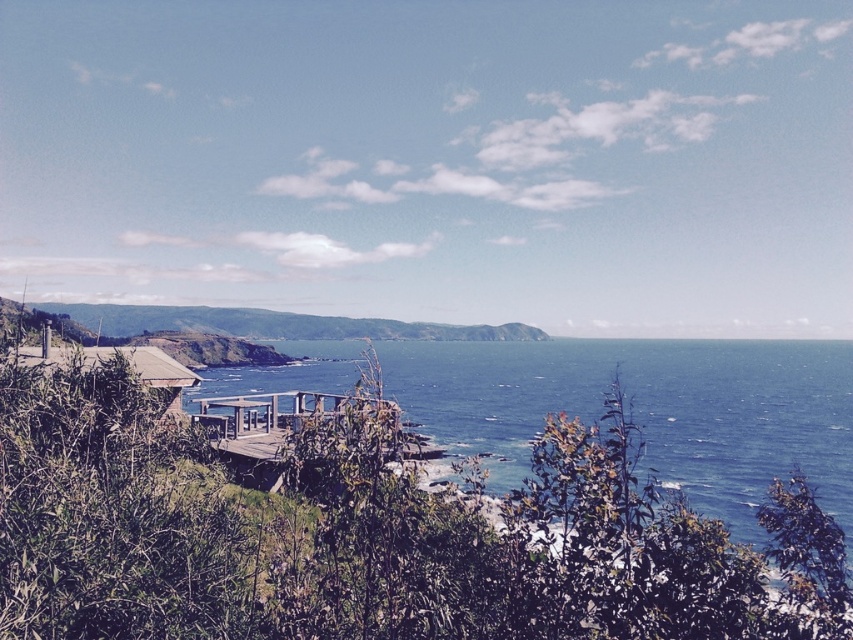
You are planning to host a small gathering and need to choose between the wooden deck at center and the wooden hut at lower left for more people. Which location can accommodate more guests?

The wooden hut at lower left can accommodate more guests since it has a larger size compared to the wooden deck at center.

You are standing on the wooden deck at center and want to climb up to the green grassy hillside at center. Is the hillside higher than the deck?

The green grassy hillside at center is much taller than the wooden deck at center, so yes, the hillside is higher than the deck.